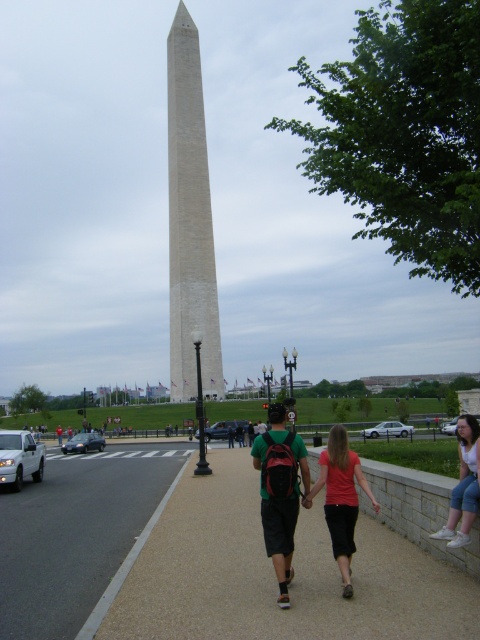
Between smooth concrete sidewalk at center and matte red shirt at center, which one is positioned higher?

matte red shirt at center is higher up.

Which is below, smooth concrete sidewalk at center or matte red shirt at center?

Positioned lower is smooth concrete sidewalk at center.

Locate an element on the screen. Image resolution: width=480 pixels, height=640 pixels. smooth concrete sidewalk at center is located at coordinates (274, 573).

Is point (254, 604) positioned in front of point (447, 429)?

Yes, point (254, 604) is closer to viewer.

Between smooth concrete sidewalk at center and silver metallic sedan at lower right, which one appears on the right side from the viewer's perspective?

silver metallic sedan at lower right

What do you see at coordinates (274, 573) in the screenshot?
I see `smooth concrete sidewalk at center` at bounding box center [274, 573].

The height and width of the screenshot is (640, 480). Find the location of `smooth concrete sidewalk at center`. smooth concrete sidewalk at center is located at coordinates (274, 573).

Can you confirm if matte red shirt at center is positioned above white matte van at lower left?

Yes.

Can you confirm if matte red shirt at center is wider than white matte van at lower left?

Incorrect, matte red shirt at center's width does not surpass white matte van at lower left's.

Which is behind, point (347, 509) or point (7, 483)?

Positioned behind is point (7, 483).

Where is `matte red shirt at center`? matte red shirt at center is located at coordinates (340, 499).